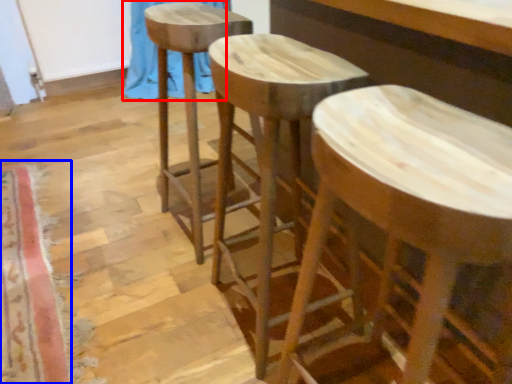
Question: Which point is further to the camera, curtain (highlighted by a red box) or mat (highlighted by a blue box)?

Choices:
 (A) curtain
 (B) mat

Answer: (A)